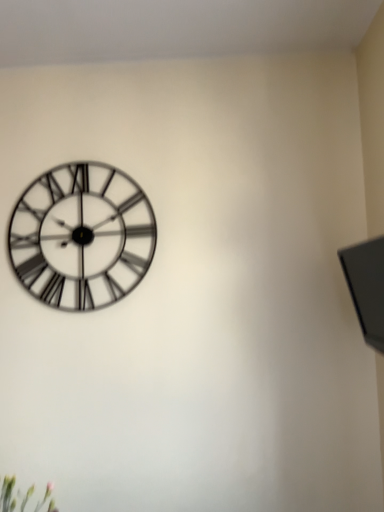
Image resolution: width=384 pixels, height=512 pixels. What do you see at coordinates (82, 236) in the screenshot? I see `white metal clock at upper left` at bounding box center [82, 236].

Identify the location of white metal clock at upper left. (82, 236).

The width and height of the screenshot is (384, 512). Find the location of `white metal clock at upper left`. white metal clock at upper left is located at coordinates (82, 236).